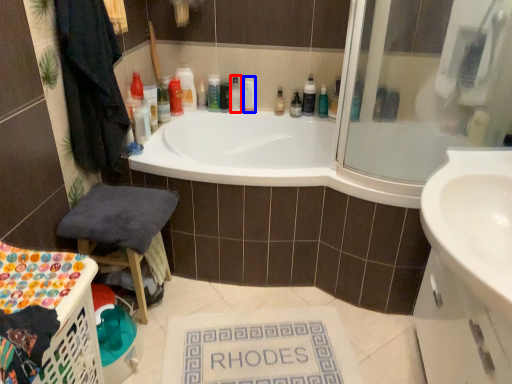
Question: Which point is further to the camera, toiletry (highlighted by a red box) or toiletry (highlighted by a blue box)?

Choices:
 (A) toiletry
 (B) toiletry

Answer: (B)